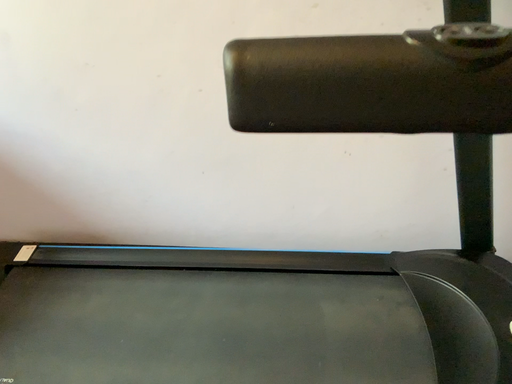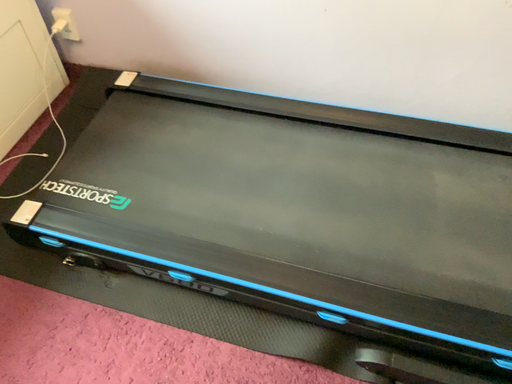
Question: Which way did the camera rotate in the video?

Choices:
 (A) rotated upward
 (B) rotated downward

Answer: (B)